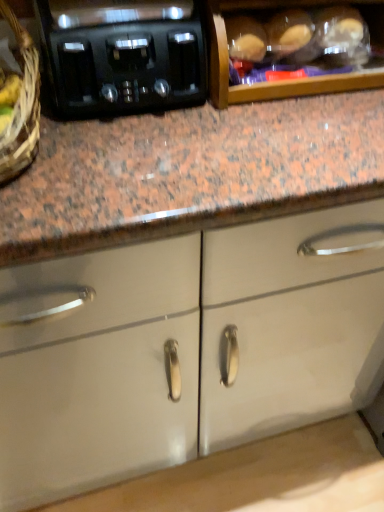
What do you see at coordinates (185, 347) in the screenshot? Image resolution: width=384 pixels, height=512 pixels. I see `white glossy cabinet doors at center, placed as the first cabinetry when sorted from bottom to top` at bounding box center [185, 347].

Locate an element on the screen. This screenshot has width=384, height=512. black plastic toaster at upper left is located at coordinates (122, 55).

Could you tell me if black plastic toaster at upper left is facing white glossy cabinet doors at center, marked as the first cabinetry in a back-to-front arrangement?

No, black plastic toaster at upper left is not facing towards white glossy cabinet doors at center, marked as the first cabinetry in a back-to-front arrangement.

Can you tell me how much black plastic toaster at upper left and white glossy cabinet doors at center, which is the 2th cabinetry in front-to-back order, differ in facing direction?

There is a 89.7-degree angle between the facing directions of black plastic toaster at upper left and white glossy cabinet doors at center, which is the 2th cabinetry in front-to-back order.

From a real-world perspective, which is physically below, black plastic toaster at upper left or white glossy cabinet doors at center, marked as the first cabinetry in a back-to-front arrangement?

white glossy cabinet doors at center, marked as the first cabinetry in a back-to-front arrangement, is physically lower.

Are white glossy cabinet doors at center, which is the 2th cabinetry in front-to-back order, and wooden cabinet at upper center, acting as the 1th cabinetry starting from the top, making contact?

No.

Who is smaller, white glossy cabinet doors at center, placed as the first cabinetry when sorted from bottom to top, or wooden cabinet at upper center, arranged as the 1th cabinetry when viewed from the front?

wooden cabinet at upper center, arranged as the 1th cabinetry when viewed from the front.

Which of these two, white glossy cabinet doors at center, placed as the first cabinetry when sorted from bottom to top, or wooden cabinet at upper center, which ranks as the 2th cabinetry in back-to-front order, stands shorter?

With less height is white glossy cabinet doors at center, placed as the first cabinetry when sorted from bottom to top.

Does point (231, 387) lie in front of point (289, 50)?

No, (231, 387) is behind (289, 50).

From the image's perspective, is wooden cabinet at upper center, arranged as the 1th cabinetry when viewed from the front, positioned above or below black plastic toaster at upper left?

Based on their image positions, wooden cabinet at upper center, arranged as the 1th cabinetry when viewed from the front, is located above black plastic toaster at upper left.

Is black plastic toaster at upper left completely or partially inside wooden cabinet at upper center, which ranks as the 2th cabinetry in back-to-front order?

Actually, black plastic toaster at upper left is outside wooden cabinet at upper center, which ranks as the 2th cabinetry in back-to-front order.

This screenshot has height=512, width=384. In the image, there is a black plastic toaster at upper left. In order to click on cabinetry above it (from the image's perspective) in this screenshot , I will do `click(294, 45)`.

Considering the positions of points (347, 5) and (141, 17), is point (347, 5) farther from camera compared to point (141, 17)?

Yes, point (347, 5) is behind point (141, 17).

Considering the sizes of woven brown basket at left and black plastic toaster at upper left in the image, is woven brown basket at left bigger or smaller than black plastic toaster at upper left?

Clearly, woven brown basket at left is smaller in size than black plastic toaster at upper left.

How far apart are woven brown basket at left and black plastic toaster at upper left?

5.67 inches.

Is woven brown basket at left looking in the opposite direction of black plastic toaster at upper left?

No, woven brown basket at left is not facing the opposite direction of black plastic toaster at upper left.

Between woven brown basket at left and black plastic toaster at upper left, which one has more height?

woven brown basket at left.

Considering the sizes of woven brown basket at left and white glossy cabinet doors at center, marked as the first cabinetry in a back-to-front arrangement, in the image, is woven brown basket at left taller or shorter than white glossy cabinet doors at center, marked as the first cabinetry in a back-to-front arrangement,?

Clearly, woven brown basket at left is taller compared to white glossy cabinet doors at center, marked as the first cabinetry in a back-to-front arrangement.

Between woven brown basket at left and white glossy cabinet doors at center, placed as the first cabinetry when sorted from bottom to top, which one has smaller size?

Smaller between the two is woven brown basket at left.

Would you consider woven brown basket at left to be distant from white glossy cabinet doors at center, acting as the 2th cabinetry starting from the top?

No.

Is woven brown basket at left wider than wooden cabinet at upper center, acting as the 1th cabinetry starting from the top?

Yes, woven brown basket at left is wider than wooden cabinet at upper center, acting as the 1th cabinetry starting from the top.

Consider the image. Can you tell me how much woven brown basket at left and wooden cabinet at upper center, acting as the 1th cabinetry starting from the top, differ in facing direction?

They differ by 2.1 degrees in their facing directions.

Is point (8, 129) farther from camera compared to point (373, 24)?

No.

From the picture: Considering the positions of objects woven brown basket at left and wooden cabinet at upper center, arranged as the 1th cabinetry when viewed from the front, in the image provided, who is behind, woven brown basket at left or wooden cabinet at upper center, arranged as the 1th cabinetry when viewed from the front,?

wooden cabinet at upper center, arranged as the 1th cabinetry when viewed from the front, is further from the camera.

Is wooden cabinet at upper center, which ranks as the 2th cabinetry in back-to-front order, not near white glossy cabinet doors at center, placed as the first cabinetry when sorted from bottom to top?

That's not correct — wooden cabinet at upper center, which ranks as the 2th cabinetry in back-to-front order, is a little close to white glossy cabinet doors at center, placed as the first cabinetry when sorted from bottom to top.

From a real-world perspective, between wooden cabinet at upper center, the second cabinetry positioned from the bottom, and white glossy cabinet doors at center, marked as the first cabinetry in a back-to-front arrangement, who is vertically lower?

In real-world perspective, white glossy cabinet doors at center, marked as the first cabinetry in a back-to-front arrangement, is lower.

Considering the positions of point (357, 22) and point (2, 426), is point (357, 22) closer or farther from the camera than point (2, 426)?

Point (357, 22) is farther from the camera than point (2, 426).

In the scene shown: Do you think wooden cabinet at upper center, arranged as the 1th cabinetry when viewed from the front, is within white glossy cabinet doors at center, which is the 2th cabinetry in front-to-back order, or outside of it?

wooden cabinet at upper center, arranged as the 1th cabinetry when viewed from the front, exists outside the volume of white glossy cabinet doors at center, which is the 2th cabinetry in front-to-back order.

At what (x,y) coordinates should I click in order to perform the action: click on home appliance in front of the white glossy cabinet doors at center, marked as the first cabinetry in a back-to-front arrangement. Please return your answer as a coordinate pair (x, y). Image resolution: width=384 pixels, height=512 pixels. Looking at the image, I should click on (122, 55).

The width and height of the screenshot is (384, 512). What are the coordinates of `cabinetry above the white glossy cabinet doors at center, which is the 2th cabinetry in front-to-back order (from the image's perspective)` in the screenshot? It's located at (294, 45).

Considering their positions, is black plastic toaster at upper left positioned closer to wooden cabinet at upper center, acting as the 1th cabinetry starting from the top, than woven brown basket at left?

black plastic toaster at upper left is positioned closer to the anchor wooden cabinet at upper center, acting as the 1th cabinetry starting from the top.

Which object lies further to the anchor point wooden cabinet at upper center, arranged as the 1th cabinetry when viewed from the front, white glossy cabinet doors at center, placed as the first cabinetry when sorted from bottom to top, or black plastic toaster at upper left?

white glossy cabinet doors at center, placed as the first cabinetry when sorted from bottom to top, is positioned further to the anchor wooden cabinet at upper center, arranged as the 1th cabinetry when viewed from the front.

Considering their positions, is black plastic toaster at upper left positioned further to white glossy cabinet doors at center, which is the 2th cabinetry in front-to-back order, than wooden cabinet at upper center, the second cabinetry positioned from the bottom?

Based on the image, wooden cabinet at upper center, the second cabinetry positioned from the bottom, appears to be further to white glossy cabinet doors at center, which is the 2th cabinetry in front-to-back order.

Estimate the real-world distances between objects in this image. Which object is closer to woven brown basket at left, wooden cabinet at upper center, which ranks as the 2th cabinetry in back-to-front order, or black plastic toaster at upper left?

The object closer to woven brown basket at left is black plastic toaster at upper left.

When comparing their distances from black plastic toaster at upper left, does wooden cabinet at upper center, acting as the 1th cabinetry starting from the top, or white glossy cabinet doors at center, acting as the 2th cabinetry starting from the top, seem closer?

wooden cabinet at upper center, acting as the 1th cabinetry starting from the top, is positioned closer to the anchor black plastic toaster at upper left.

Looking at the image, which one is located further to black plastic toaster at upper left, woven brown basket at left or wooden cabinet at upper center, acting as the 1th cabinetry starting from the top?

wooden cabinet at upper center, acting as the 1th cabinetry starting from the top, is further to black plastic toaster at upper left.

Which object lies nearer to the anchor point white glossy cabinet doors at center, which is the 2th cabinetry in front-to-back order, woven brown basket at left or wooden cabinet at upper center, which ranks as the 2th cabinetry in back-to-front order?

The object closer to white glossy cabinet doors at center, which is the 2th cabinetry in front-to-back order, is woven brown basket at left.

Based on their spatial positions, is black plastic toaster at upper left or white glossy cabinet doors at center, placed as the first cabinetry when sorted from bottom to top, closer to wooden cabinet at upper center, which ranks as the 2th cabinetry in back-to-front order?

Based on the image, black plastic toaster at upper left appears to be nearer to wooden cabinet at upper center, which ranks as the 2th cabinetry in back-to-front order.

Find the location of a particular element. This screenshot has width=384, height=512. home appliance between woven brown basket at left and wooden cabinet at upper center, the second cabinetry positioned from the bottom, from left to right is located at coordinates (122, 55).

At what (x,y) coordinates should I click in order to perform the action: click on basket that lies between wooden cabinet at upper center, the second cabinetry positioned from the bottom, and white glossy cabinet doors at center, which is the 2th cabinetry in front-to-back order, from top to bottom. Please return your answer as a coordinate pair (x, y). The height and width of the screenshot is (512, 384). Looking at the image, I should click on (22, 106).

What are the coordinates of `basket that lies between black plastic toaster at upper left and white glossy cabinet doors at center, marked as the first cabinetry in a back-to-front arrangement, from top to bottom` in the screenshot? It's located at (22, 106).

Locate an element on the screen. The height and width of the screenshot is (512, 384). home appliance between wooden cabinet at upper center, the second cabinetry positioned from the bottom, and white glossy cabinet doors at center, placed as the first cabinetry when sorted from bottom to top, vertically is located at coordinates (122, 55).